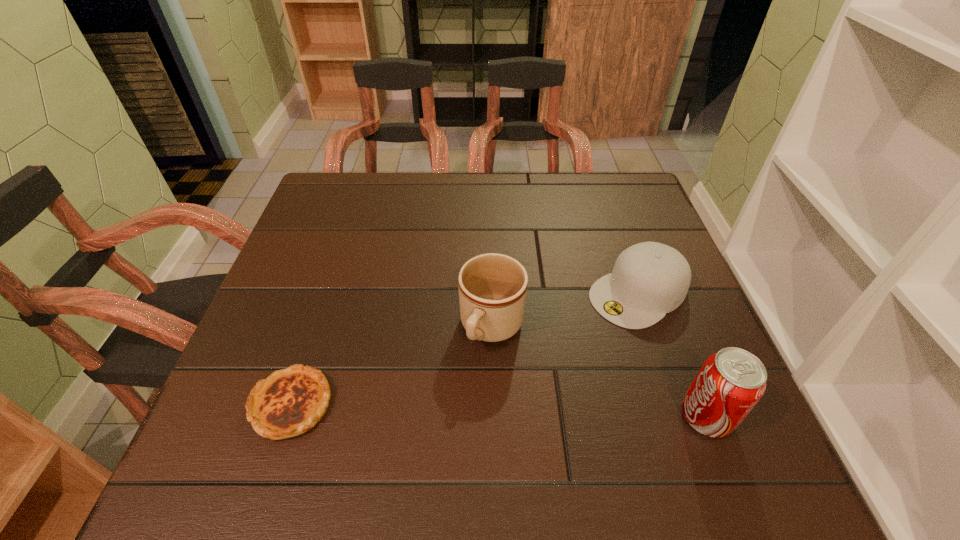
The image size is (960, 540). I want to click on vacant space on the desktop that is between the shortest object and the soda and is positioned on the side of the third shortest object with the handle, so click(446, 409).

At what (x,y) coordinates should I click in order to perform the action: click on vacant space on the desktop that is between the leftmost object and the soda and is positioned on the front-facing side of the third tallest object. Please return your answer as a coordinate pair (x, y). Looking at the image, I should click on (462, 409).